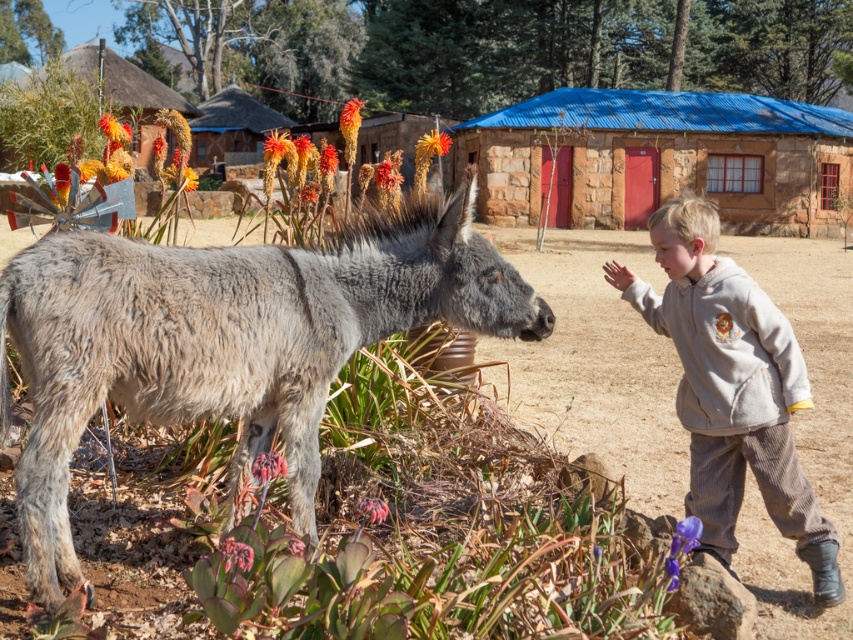
Question: Does gray fuzzy donkey at left come behind light gray corduroy pants at right?

Choices:
 (A) yes
 (B) no

Answer: (B)

Question: Which of the following is the farthest from the observer?

Choices:
 (A) gray fuzzy donkey at left
 (B) brown thatched hut at upper center
 (C) blue corrugated metal hut at center
 (D) light gray corduroy pants at right

Answer: (B)

Question: Where is light gray corduroy pants at right located in relation to thatched straw hut at upper left in the image?

Choices:
 (A) above
 (B) below

Answer: (B)

Question: Which of these objects is positioned closest to the thatched straw hut at upper left?

Choices:
 (A) gray fuzzy donkey at left
 (B) brown thatched hut at upper center
 (C) light gray corduroy pants at right
 (D) blue corrugated metal hut at center

Answer: (B)

Question: Is blue corrugated metal hut at center bigger than brown thatched hut at upper center?

Choices:
 (A) no
 (B) yes

Answer: (B)

Question: Which of the following is the closest to the observer?

Choices:
 (A) thatched straw hut at upper left
 (B) gray fuzzy donkey at left
 (C) light gray corduroy pants at right

Answer: (B)